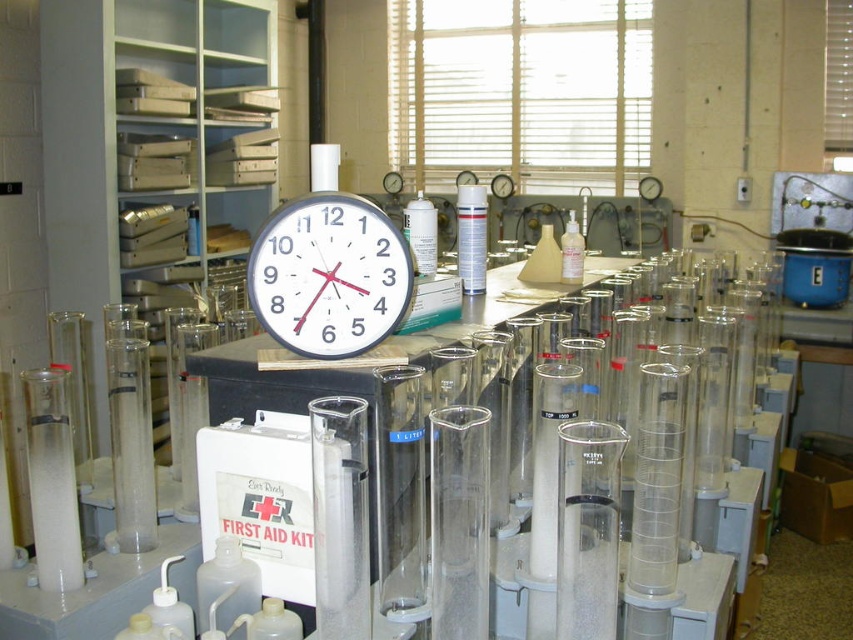
You are a lab technician needing to place both the white plastic clock at center and the translucent plastic bottle at center into a drawer that can only accommodate items up to the width of the clock. Which item will not fit?

The translucent plastic bottle at center will not fit because the white plastic clock at center is wider than it.